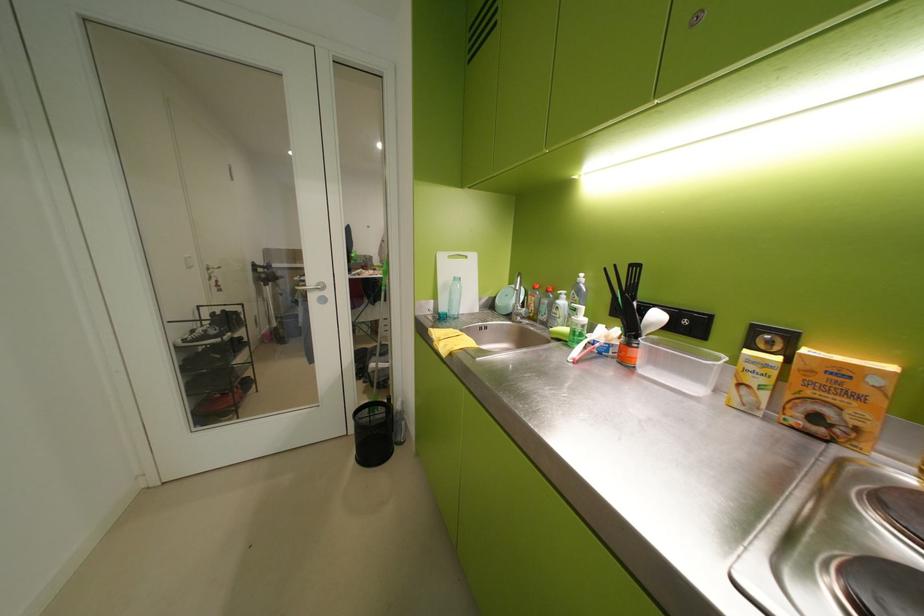
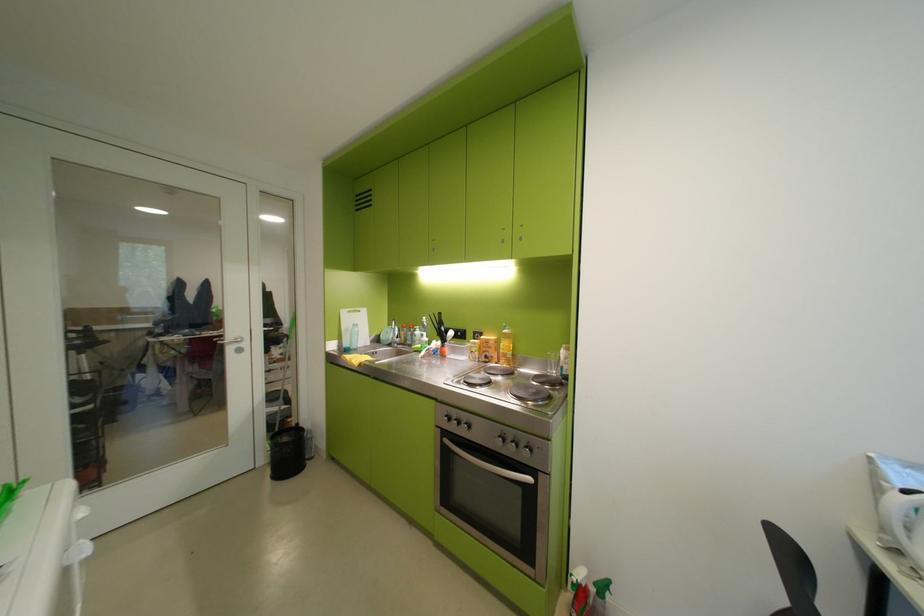
The point at (868, 398) is marked in the first image. Where is the corresponding point in the second image?

(501, 349)